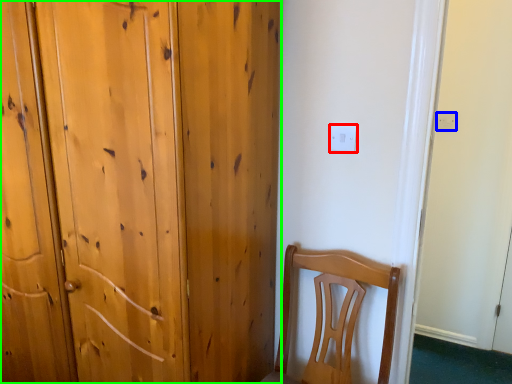
Question: Which object is positioned closest to electric outlet (highlighted by a red box)? Select from electric outlet (highlighted by a blue box) and door (highlighted by a green box).

Choices:
 (A) electric outlet
 (B) door

Answer: (B)